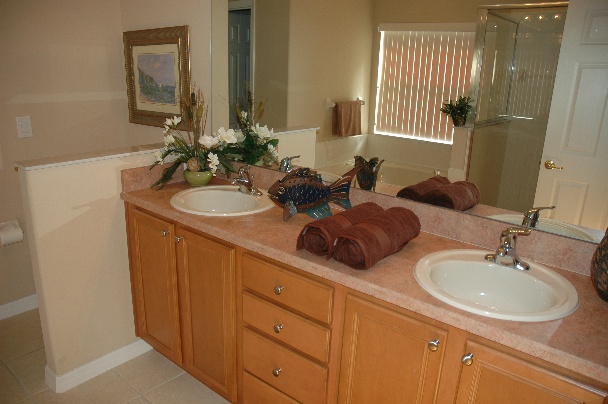
Identify the location of flower arrangement. (199, 155).